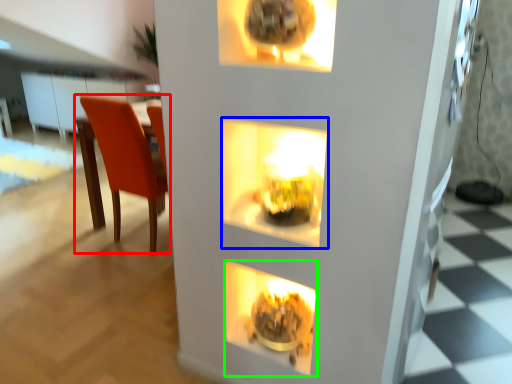
Question: Based on their relative distances, which object is farther from chair (highlighted by a red box)? Choose from shelf (highlighted by a blue box) and fireplace (highlighted by a green box).

Choices:
 (A) shelf
 (B) fireplace

Answer: (B)